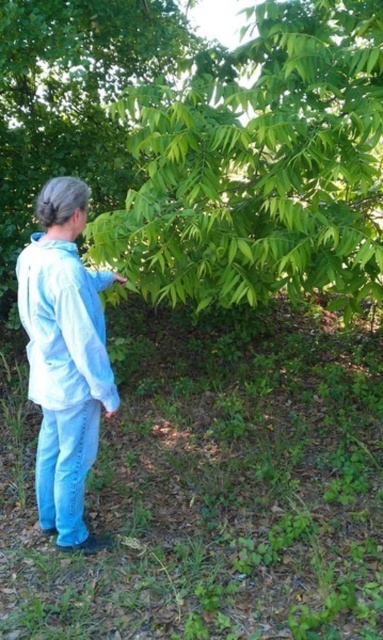
Which is below, green leafy tree at center or light blue denim pants at lower left?

light blue denim pants at lower left is below.

Does green leafy tree at center lie behind light blue denim pants at lower left?

Yes.

Is point (381, 218) closer to viewer compared to point (44, 252)?

No, (381, 218) is behind (44, 252).

You are a GUI agent. You are given a task and a screenshot of the screen. Output one action in this format:
    pyautogui.click(x=<x>, y=<y>)
    Task: Click on the green leafy tree at center
    Image resolution: width=383 pixels, height=640 pixels.
    Given the screenshot: What is the action you would take?
    pyautogui.click(x=261, y=166)